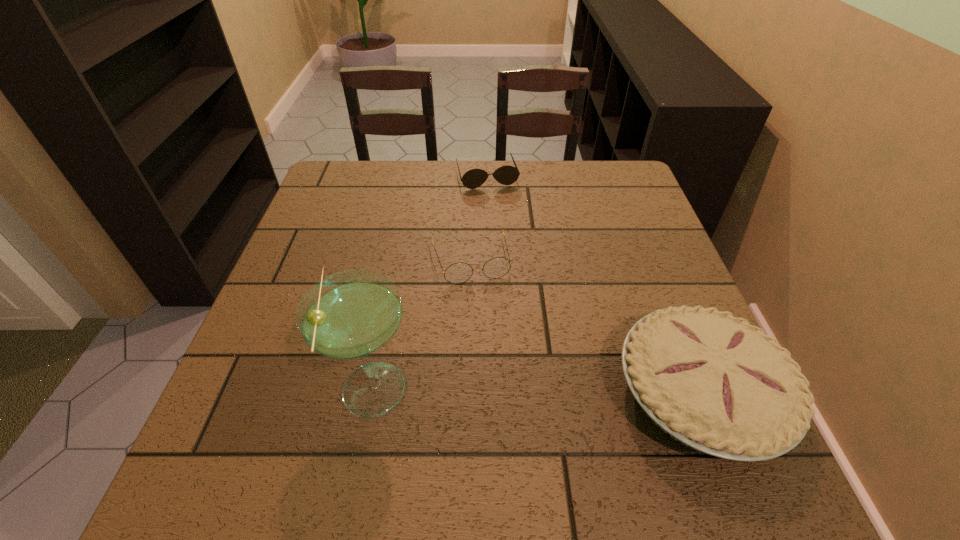
Locate an element on the screen. The height and width of the screenshot is (540, 960). martini is located at coordinates (350, 315).

In order to click on pie in this screenshot , I will do `click(717, 384)`.

Identify the location of the second tallest object. Image resolution: width=960 pixels, height=540 pixels. (x=717, y=384).

Image resolution: width=960 pixels, height=540 pixels. Identify the location of spectacles. (457, 273).

Identify the location of the farthest object. The image size is (960, 540). (506, 175).

This screenshot has width=960, height=540. I want to click on free space located on the right of the martini, so click(631, 389).

Locate an element on the screen. The height and width of the screenshot is (540, 960). vacant space situated 0.320m on the back of the rightmost object is located at coordinates (635, 230).

At what (x,y) coordinates should I click in order to perform the action: click on blank space located 0.260m on the temples of the second farthest object. Please return your answer as a coordinate pair (x, y). The width and height of the screenshot is (960, 540). Looking at the image, I should click on (504, 386).

Where is `free location located 0.160m on the temples of the second farthest object`? free location located 0.160m on the temples of the second farthest object is located at coordinates (492, 342).

Find the location of `vacant region located on the temples of the second farthest object`. vacant region located on the temples of the second farthest object is located at coordinates (485, 316).